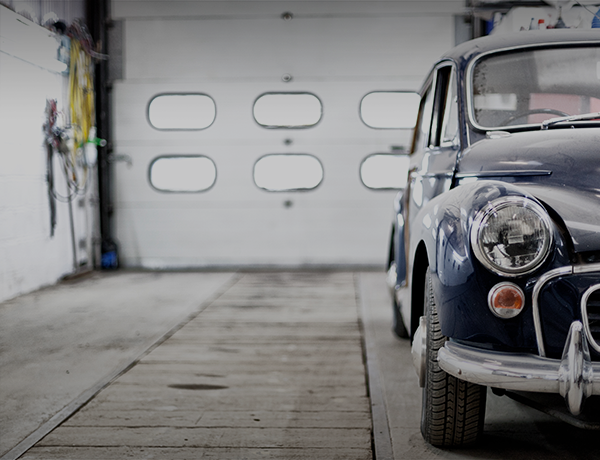
Where is `concrete floor`? This screenshot has width=600, height=460. concrete floor is located at coordinates (109, 317), (405, 384).